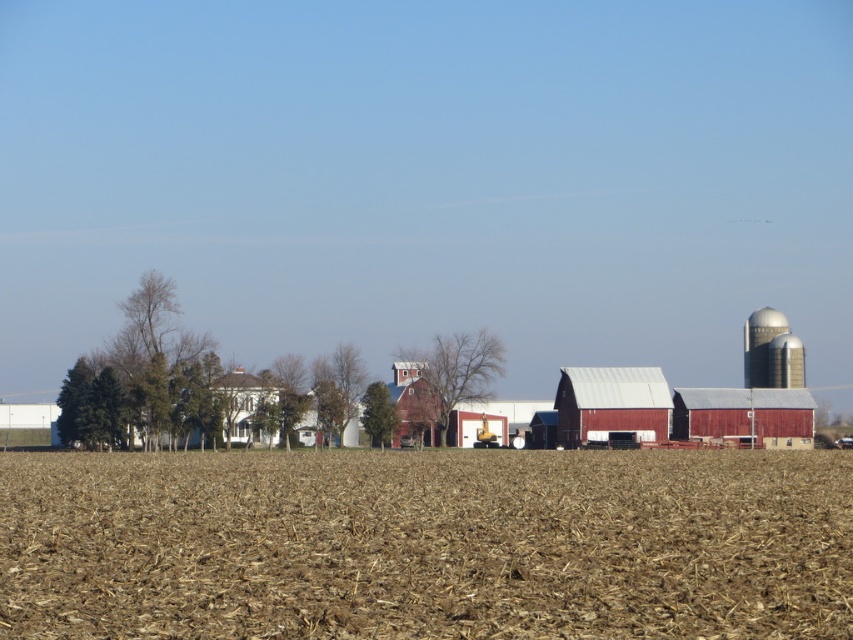
You are a farmer planning to install a fence between the white painted wood house at left and the metallic silver silo at right. If the fence needs to be placed closer to the narrower structure, where should you position it?

The white painted wood house at left has a lesser width compared to metallic silver silo at right, so the fence should be placed closer to the white painted wood house at left since it is narrower.

You are a farmer planning to plant crops in the brown dirt field at center. You need to know if there is enough space to place a new shed that will be the same size as the metallic red barn at center. Can you confirm if the field is large enough?

The brown dirt field at center is bigger than the metallic red barn at center, so yes, the field is large enough to accommodate a new shed of the same size as the metallic red barn at center.